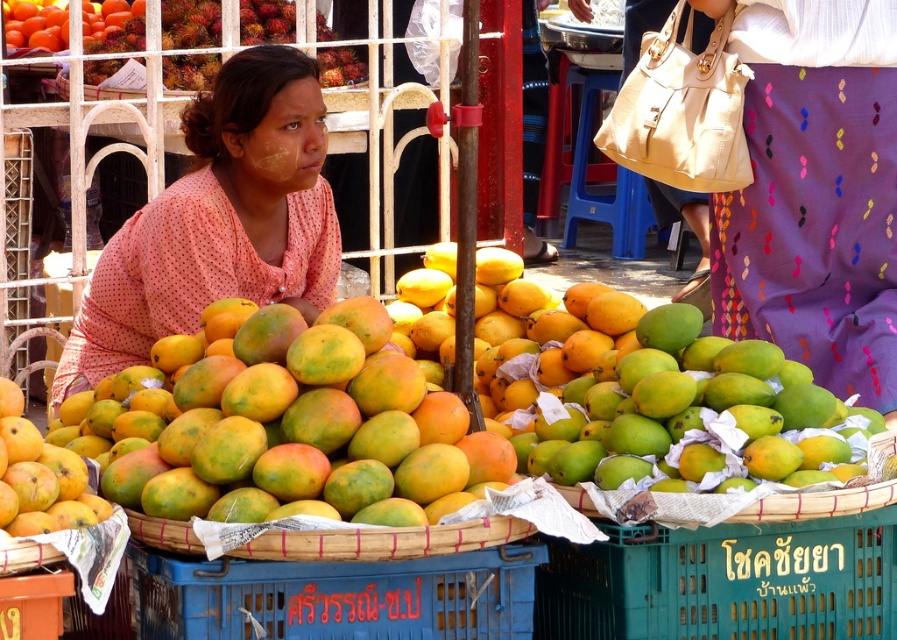
You are a customer at the market and want to buy a fruit that is wider than the other. Which fruit should you choose between the ruddy textured rambutan at upper center and the yellow matte mango at center?

The ruddy textured rambutan at upper center is wider than the yellow matte mango at center, so you should choose the ruddy textured rambutan at upper center.

You are a customer at the market and want to pick a mango from the yellow matte mango at center. However, you notice the pink dotted blouse at center is in the way. Can you reach the mango without moving the blouse?

The pink dotted blouse at center is located above the yellow matte mango at center, so you cannot reach the mango without moving the blouse.